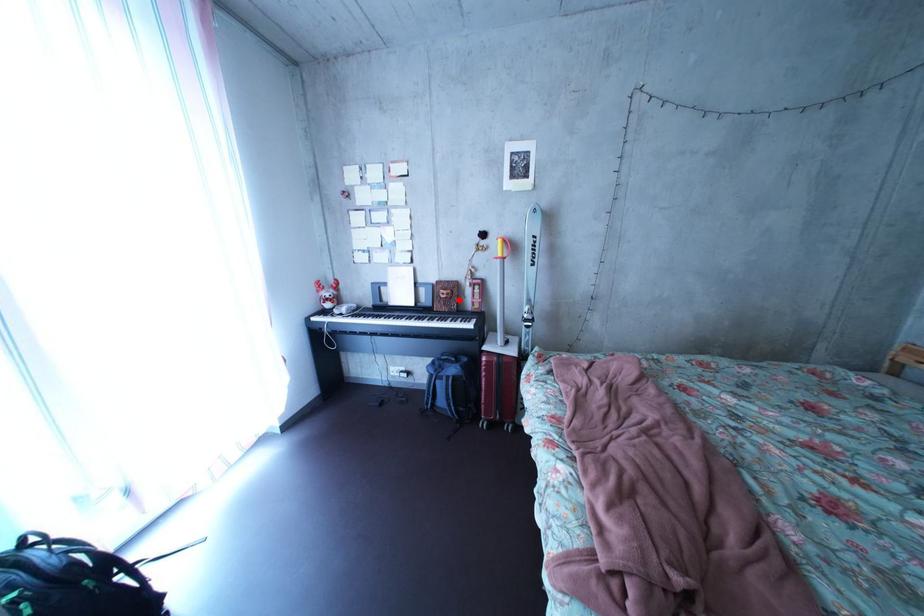
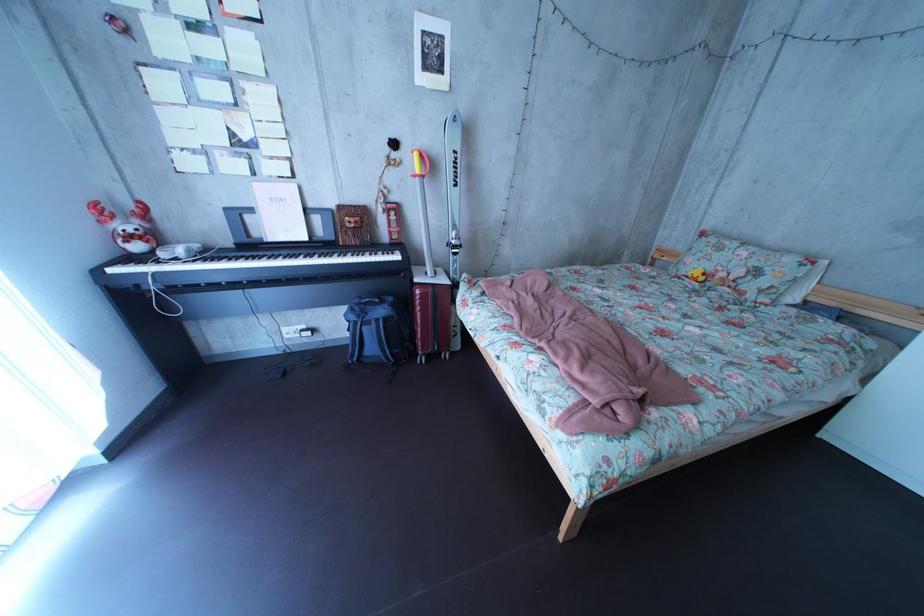
Locate, in the second image, the point that corresponds to the highlighted location in the first image.

(367, 228)